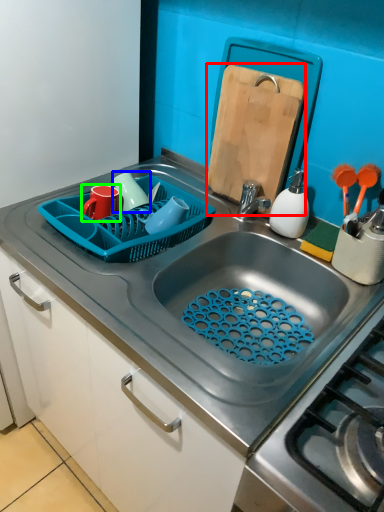
Question: Which object is the farthest from cutting board (highlighted by a red box)? Choose among these: tableware (highlighted by a blue box) or tableware (highlighted by a green box).

Choices:
 (A) tableware
 (B) tableware

Answer: (B)